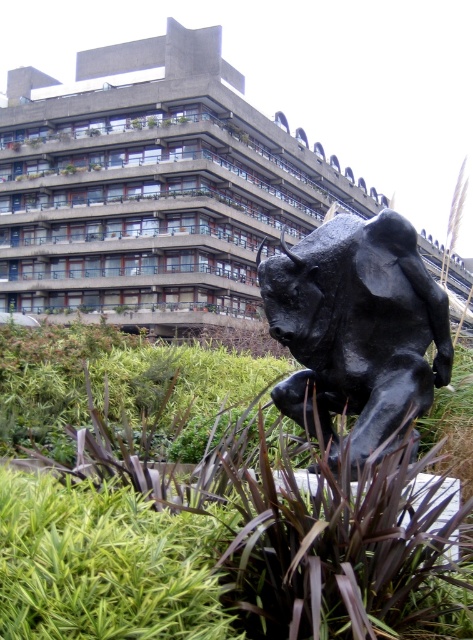
In the scene shown: You are standing in front of the modern building and notice two points marked in the image. The first point is at coordinate point (0, 282) and the second is at point (332, 225). Which point is closer to you?

Point (0, 282) is closer to you because it is further to the camera than point (332, 225).

You are a surveyor measuring distances between landmarks. You need to determine if a 40 meter long cable can stretch from the concrete building at center to the black polished bull at center. Can it reach?

The distance between the concrete building at center and the black polished bull at center is 42.03 meters, so a 40 meter cable would be insufficient. You need a longer cable.